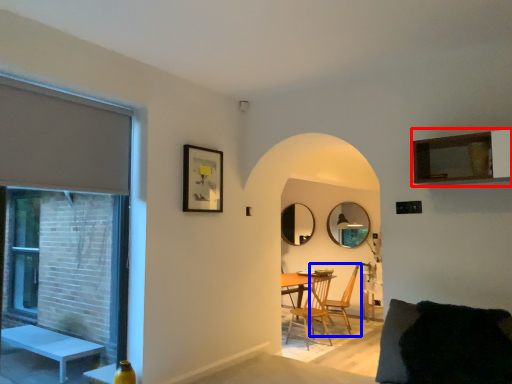
Question: Which object appears closest to the camera in this image, cabinetry (highlighted by a red box) or chair (highlighted by a blue box)?

Choices:
 (A) cabinetry
 (B) chair

Answer: (A)